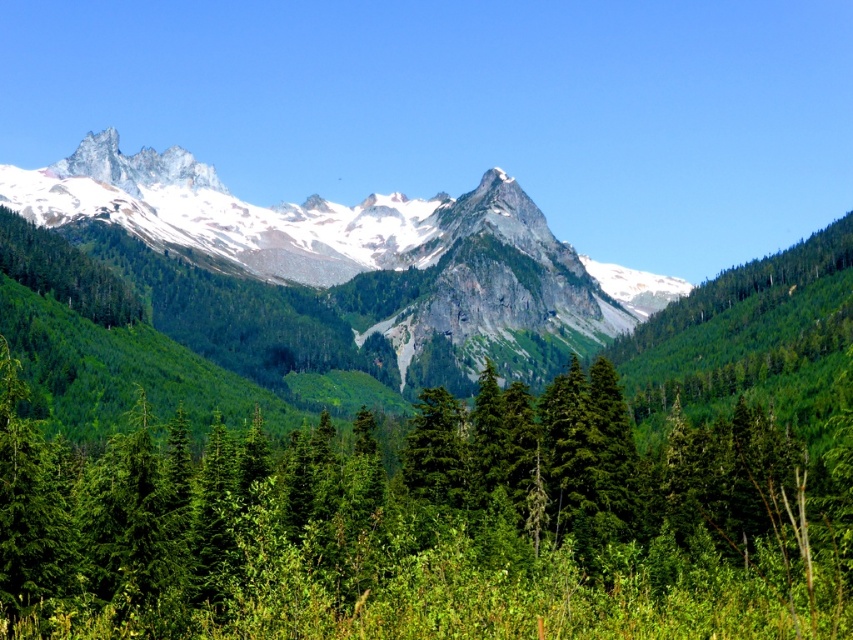
Question: Is green matte tree at center above snowy granite peak at upper left?

Choices:
 (A) no
 (B) yes

Answer: (A)

Question: Among these points, which one is nearest to the camera?

Choices:
 (A) (466, 612)
 (B) (166, 163)

Answer: (A)

Question: Is green matte tree at center above snowy granite peak at upper left?

Choices:
 (A) no
 (B) yes

Answer: (A)

Question: Is green matte tree at center further to the viewer compared to snowy granite peak at upper left?

Choices:
 (A) yes
 (B) no

Answer: (B)